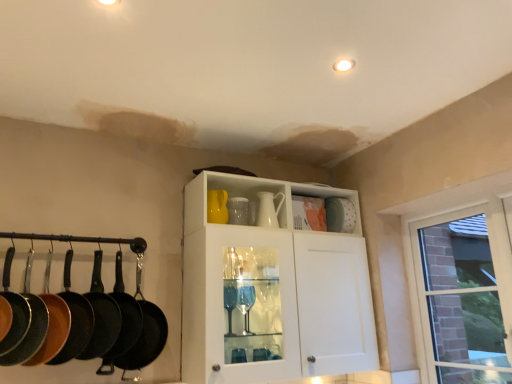
Image resolution: width=512 pixels, height=384 pixels. Describe the element at coordinates (268, 209) in the screenshot. I see `white glossy tea pot at center, positioned as the first tea pot in right-to-left order` at that location.

In the scene shown: Measure the distance between point (270, 201) and camera.

2.36 meters.

The height and width of the screenshot is (384, 512). What do you see at coordinates (217, 206) in the screenshot?
I see `matte yellow tea pot at upper center, the 1th tea pot viewed from the left` at bounding box center [217, 206].

Where is `black cast iron frying pan at left, the 4th frying pan viewed from the right`? black cast iron frying pan at left, the 4th frying pan viewed from the right is located at coordinates (74, 318).

The height and width of the screenshot is (384, 512). Describe the element at coordinates (271, 288) in the screenshot. I see `white glossy cabinet at center` at that location.

Based on the photo, measure the distance between white matte platter at upper right and camera.

white matte platter at upper right and camera are 2.51 meters apart from each other.

Describe the element at coordinates (340, 215) in the screenshot. Image resolution: width=512 pixels, height=384 pixels. I see `white matte platter at upper right` at that location.

Find the location of a particular element. This screenshot has width=512, height=384. black cast iron frying pan at left, the sixth frying pan positioned from the left is located at coordinates (145, 332).

Image resolution: width=512 pixels, height=384 pixels. I want to click on matte black frying pan at left, which is the 6th frying pan from right to left, so click(14, 310).

You are a GUI agent. You are given a task and a screenshot of the screen. Output one action in this format:
    pyautogui.click(x=<x>, y=<y>)
    Task: Click on the frying pan that is the 2nd object directly below the white glossy cabinet at center (from a real-world perspective)
    The height and width of the screenshot is (384, 512).
    Given the screenshot: What is the action you would take?
    pyautogui.click(x=52, y=322)

Is black non-stick frying pan at left, which is the 5th frying pan from right to left, positioned with its back to white glossy cabinet at center?

No, black non-stick frying pan at left, which is the 5th frying pan from right to left, is not facing away from white glossy cabinet at center.

From a real-world perspective, is black non-stick frying pan at left, which is the 5th frying pan from right to left, beneath white glossy cabinet at center?

Yes, from a real-world perspective, black non-stick frying pan at left, which is the 5th frying pan from right to left, is below white glossy cabinet at center.

Is black non-stick frying pan at left, which is the 5th frying pan from right to left, with white glossy cabinet at center?

black non-stick frying pan at left, which is the 5th frying pan from right to left, and white glossy cabinet at center are not in contact.

Between white glossy cabinet at center and black cast iron frying pan at left, the sixth frying pan positioned from the left, which one appears on the left side from the viewer's perspective?

Positioned to the left is black cast iron frying pan at left, the sixth frying pan positioned from the left.

From the image's perspective, is white glossy cabinet at center positioned above or below black cast iron frying pan at left, the sixth frying pan positioned from the left?

white glossy cabinet at center is situated higher than black cast iron frying pan at left, the sixth frying pan positioned from the left, in the image.

Would you consider white glossy cabinet at center to be distant from black cast iron frying pan at left, which ranks as the 1th frying pan in right-to-left order?

white glossy cabinet at center is near black cast iron frying pan at left, which ranks as the 1th frying pan in right-to-left order, not far away.

Which of these two, white glossy cabinet at center or black cast iron frying pan at left, the sixth frying pan positioned from the left, is smaller?

black cast iron frying pan at left, the sixth frying pan positioned from the left.

Are black non-stick frying pan at left, acting as the second frying pan starting from the left, and matte black frying pan at left, which is the 6th frying pan from right to left, beside each other?

No.

Between black non-stick frying pan at left, which is the 5th frying pan from right to left, and matte black frying pan at left, which is the 6th frying pan from right to left, which one is positioned behind?

black non-stick frying pan at left, which is the 5th frying pan from right to left, is more distant.

Does black non-stick frying pan at left, which is the 5th frying pan from right to left, have a lesser width compared to matte black frying pan at left, which is the 6th frying pan from right to left?

In fact, black non-stick frying pan at left, which is the 5th frying pan from right to left, might be wider than matte black frying pan at left, which is the 6th frying pan from right to left.

This screenshot has width=512, height=384. Find the location of `frying pan that is the 1st object located below the matte black frying pan at left, the first frying pan viewed from the left (from the image's perspective)`. frying pan that is the 1st object located below the matte black frying pan at left, the first frying pan viewed from the left (from the image's perspective) is located at coordinates (52, 322).

Considering the sizes of objects black cast iron frying pan at left, which is the third frying pan from right to left, and matte yellow tea pot at upper center, the 1th tea pot viewed from the left, in the image provided, who is shorter, black cast iron frying pan at left, which is the third frying pan from right to left, or matte yellow tea pot at upper center, the 1th tea pot viewed from the left,?

matte yellow tea pot at upper center, the 1th tea pot viewed from the left, is shorter.

Which point is more distant from viewer, (109, 328) or (213, 199)?

The point (213, 199) is farther from the camera.

Who is bigger, black cast iron frying pan at left, marked as the 4th frying pan in a left-to-right arrangement, or matte yellow tea pot at upper center, the 1th tea pot viewed from the left?

black cast iron frying pan at left, marked as the 4th frying pan in a left-to-right arrangement.

From the image's perspective, between black cast iron frying pan at left, which is the third frying pan from right to left, and matte yellow tea pot at upper center, the 2th tea pot positioned from the right, which one is located above?

matte yellow tea pot at upper center, the 2th tea pot positioned from the right.

Consider the image. Considering the relative positions of white glossy cabinet at center and black cast iron frying pan at left, marked as the 4th frying pan in a left-to-right arrangement, in the image provided, is white glossy cabinet at center behind black cast iron frying pan at left, marked as the 4th frying pan in a left-to-right arrangement,?

No, white glossy cabinet at center is closer to the viewer.

Does white glossy cabinet at center have a smaller size compared to black cast iron frying pan at left, which is the third frying pan from right to left?

Incorrect, white glossy cabinet at center is not smaller in size than black cast iron frying pan at left, which is the third frying pan from right to left.

Which object is positioned more to the left, white glossy cabinet at center or black cast iron frying pan at left, which is the third frying pan from right to left?

black cast iron frying pan at left, which is the third frying pan from right to left.

Consider the image. Is black cast iron frying pan at left, which is the third frying pan from right to left, a part of white glossy cabinet at center?

No, black cast iron frying pan at left, which is the third frying pan from right to left, is not inside white glossy cabinet at center.

Choose the correct answer: Is white matte platter at upper right inside white glossy tea pot at center, which is counted as the 2th tea pot, starting from the left, or outside it?

white matte platter at upper right lies outside white glossy tea pot at center, which is counted as the 2th tea pot, starting from the left.

Considering the relative sizes of white matte platter at upper right and white glossy tea pot at center, which is counted as the 2th tea pot, starting from the left, in the image provided, is white matte platter at upper right smaller than white glossy tea pot at center, which is counted as the 2th tea pot, starting from the left,?

Yes.

From a real-world perspective, relative to white glossy tea pot at center, positioned as the first tea pot in right-to-left order, is white matte platter at upper right vertically above or below?

white matte platter at upper right is above white glossy tea pot at center, positioned as the first tea pot in right-to-left order.

Which is less distant, (336, 206) or (262, 219)?

Point (336, 206).

In the scene shown: Is black cast iron frying pan at left, the sixth frying pan positioned from the left, placed right next to white matte platter at upper right?

There is a gap between black cast iron frying pan at left, the sixth frying pan positioned from the left, and white matte platter at upper right.

Is point (147, 340) behind point (328, 226)?

No.

Which object is further away from the camera, black cast iron frying pan at left, which ranks as the 1th frying pan in right-to-left order, or white matte platter at upper right?

white matte platter at upper right is more distant.

Would you say black cast iron frying pan at left, which ranks as the 1th frying pan in right-to-left order, is to the left or to the right of white matte platter at upper right in the picture?

black cast iron frying pan at left, which ranks as the 1th frying pan in right-to-left order, is to the left of white matte platter at upper right.

Image resolution: width=512 pixels, height=384 pixels. I want to click on the 1st frying pan below the white glossy cabinet at center (from the image's perspective), so click(52, 322).

Locate an element on the screen. The height and width of the screenshot is (384, 512). the 1st frying pan to the left when counting from the white glossy cabinet at center is located at coordinates (145, 332).

Which object lies further to the anchor point black cast iron frying pan at left, which ranks as the 1th frying pan in right-to-left order, black cast iron frying pan at left, the 4th frying pan viewed from the right, or white matte platter at upper right?

Among the two, white matte platter at upper right is located further to black cast iron frying pan at left, which ranks as the 1th frying pan in right-to-left order.

Looking at the image, which one is located closer to matte black frying pan at left, which is the 6th frying pan from right to left, black cast iron frying pan at left, which ranks as the 1th frying pan in right-to-left order, or black cast iron frying pan at left, which is the third frying pan from right to left?

black cast iron frying pan at left, which is the third frying pan from right to left, is positioned closer to the anchor matte black frying pan at left, which is the 6th frying pan from right to left.

Estimate the real-world distances between objects in this image. Which object is further from white matte platter at upper right, black cast iron frying pan at left, which ranks as the 1th frying pan in right-to-left order, or black cast iron frying pan at left, which is the third frying pan from right to left?

The object further to white matte platter at upper right is black cast iron frying pan at left, which is the third frying pan from right to left.

When comparing their distances from black cast iron frying pan at left, placed as the second frying pan when sorted from right to left, does black cast iron frying pan at left, which ranks as the 1th frying pan in right-to-left order, or white glossy cabinet at center seem further?

white glossy cabinet at center is positioned further to the anchor black cast iron frying pan at left, placed as the second frying pan when sorted from right to left.

Based on their spatial positions, is black cast iron frying pan at left, which ranks as the 1th frying pan in right-to-left order, or black non-stick frying pan at left, acting as the second frying pan starting from the left, further from white glossy cabinet at center?

Among the two, black non-stick frying pan at left, acting as the second frying pan starting from the left, is located further to white glossy cabinet at center.

From the image, which object appears to be nearer to matte black frying pan at left, the first frying pan viewed from the left, black cast iron frying pan at left, acting as the 5th frying pan starting from the left, or white glossy tea pot at center, which is counted as the 2th tea pot, starting from the left?

The object closer to matte black frying pan at left, the first frying pan viewed from the left, is black cast iron frying pan at left, acting as the 5th frying pan starting from the left.

From the image, which object appears to be farther from matte yellow tea pot at upper center, the 2th tea pot positioned from the right, black cast iron frying pan at left, which ranks as the 1th frying pan in right-to-left order, or black non-stick frying pan at left, acting as the second frying pan starting from the left?

black non-stick frying pan at left, acting as the second frying pan starting from the left, is further to matte yellow tea pot at upper center, the 2th tea pot positioned from the right.

Looking at this image, considering their positions, is black cast iron frying pan at left, the sixth frying pan positioned from the left, positioned further to matte black frying pan at left, the first frying pan viewed from the left, than black cast iron frying pan at left, placed as the second frying pan when sorted from right to left?

black cast iron frying pan at left, the sixth frying pan positioned from the left.

This screenshot has width=512, height=384. Find the location of `cabinetry located between matte yellow tea pot at upper center, the 1th tea pot viewed from the left, and white matte platter at upper right in the left-right direction`. cabinetry located between matte yellow tea pot at upper center, the 1th tea pot viewed from the left, and white matte platter at upper right in the left-right direction is located at coordinates (271, 288).

Find the location of a particular element. Image resolution: width=512 pixels, height=384 pixels. frying pan between black cast iron frying pan at left, the 4th frying pan viewed from the right, and black cast iron frying pan at left, acting as the 5th frying pan starting from the left is located at coordinates (101, 315).

The width and height of the screenshot is (512, 384). Find the location of `tea pot located between matte yellow tea pot at upper center, the 1th tea pot viewed from the left, and white matte platter at upper right in the left-right direction`. tea pot located between matte yellow tea pot at upper center, the 1th tea pot viewed from the left, and white matte platter at upper right in the left-right direction is located at coordinates (268, 209).

At what (x,y) coordinates should I click in order to perform the action: click on tea pot between black cast iron frying pan at left, which is the 3th frying pan in left-to-right order, and white glossy tea pot at center, positioned as the first tea pot in right-to-left order, from left to right. Please return your answer as a coordinate pair (x, y). The width and height of the screenshot is (512, 384). Looking at the image, I should click on (217, 206).